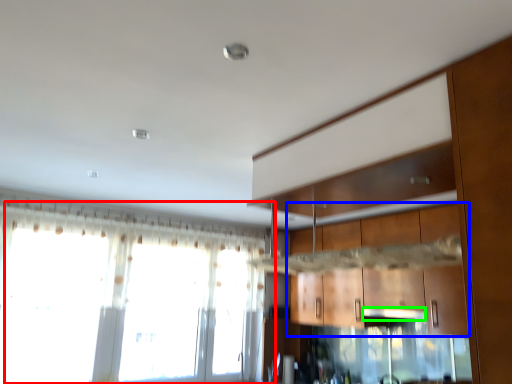
Question: Which is farther away from window (highlighted by a red box)? cabinetry (highlighted by a blue box) or exhaust hood (highlighted by a green box)?

Choices:
 (A) cabinetry
 (B) exhaust hood

Answer: (B)